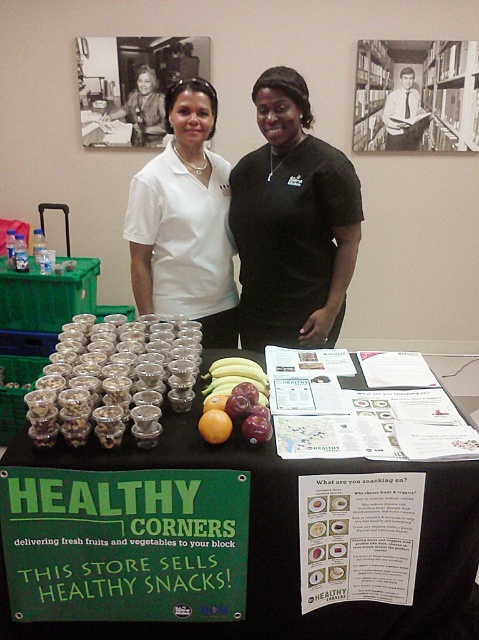
Question: Considering the relative positions of translucent glass cups at center and metallic silver bookshelf at upper right in the image provided, where is translucent glass cups at center located with respect to metallic silver bookshelf at upper right?

Choices:
 (A) above
 (B) below

Answer: (B)

Question: Which point is farther to the camera?

Choices:
 (A) (128, 380)
 (B) (330, 218)
 (C) (206, 83)

Answer: (C)

Question: Considering the relative positions of black fabric table at center and yellow matte apple at center in the image provided, where is black fabric table at center located with respect to yellow matte apple at center?

Choices:
 (A) above
 (B) below

Answer: (B)

Question: Does black matte shirt at center come behind translucent glass cups at center?

Choices:
 (A) no
 (B) yes

Answer: (B)

Question: Which object is the farthest from the yellow matte apple at center?

Choices:
 (A) shiny red apples at center
 (B) black fabric table at center
 (C) black matte shirt at center
 (D) white smooth shirt at center

Answer: (D)

Question: Which object is closer to the camera taking this photo?

Choices:
 (A) black fabric table at center
 (B) yellow matte apple at center
 (C) shiny red apples at center

Answer: (A)